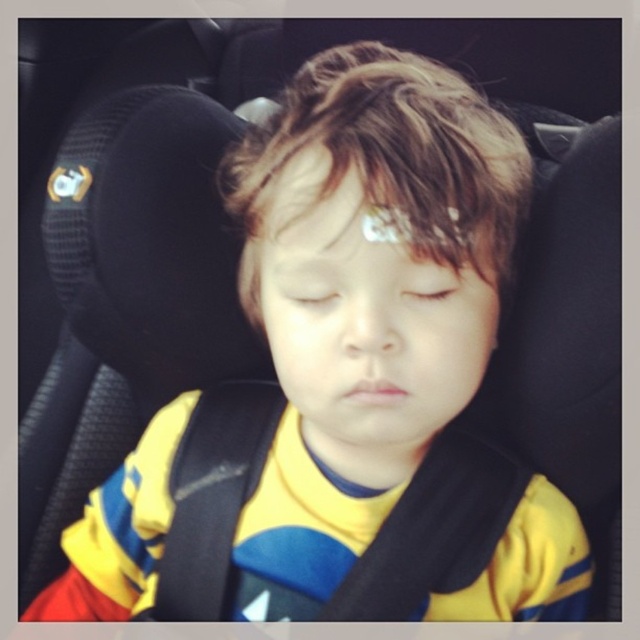
You are a safety inspector checking the car seat for proper installation. You notice the transparent plastic eye at center and the light brown skin at center. Which object has a greater width?

The transparent plastic eye at center has a greater width than the light brown skin at center according to the description.

Consider the image. You are a safety inspector checking the car seat. You notice a point at coordinates [310,292]. What object is located at this point?

The transparent plastic eye at center is located at point [310,292].

You are a safety inspector checking the car seat of a sleeping child. The car seat has a harness system. You notice the matte white forehead at center. Based on its position, is the harness properly adjusted to keep the child safe?

The matte white forehead at center is located at point coordinates (x=365, y=212). Since the harness system should position the child so that the forehead is centered and aligned with the seat, the harness is properly adjusted to keep the child safe.